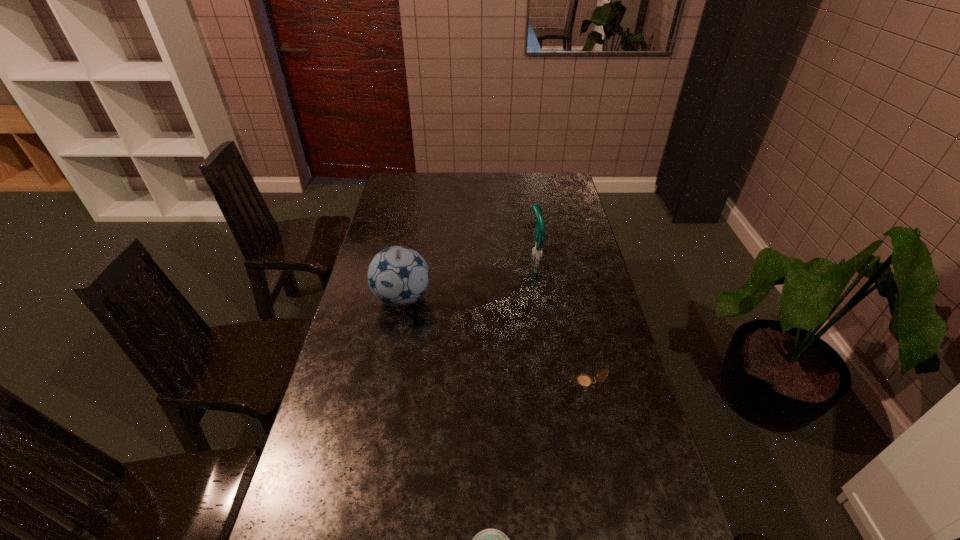
Locate an element on the screen. The width and height of the screenshot is (960, 540). vacant area between the third farthest object and the second object from right to left is located at coordinates (561, 318).

Find the location of a particular element. unoccupied position between the leftmost object and the compass is located at coordinates (494, 341).

Where is `blank region between the leftmost object and the farthest object`? This screenshot has width=960, height=540. blank region between the leftmost object and the farthest object is located at coordinates (468, 276).

At what (x,y) coordinates should I click in order to perform the action: click on vacant point located between the third object from left to right and the second farthest object. Please return your answer as a coordinate pair (x, y). Looking at the image, I should click on (468, 276).

Locate an element on the screen. object that can be found as the closest to the farthest object is located at coordinates [x=398, y=276].

Where is `object that can be found as the second closest to the second object from right to left`? The width and height of the screenshot is (960, 540). object that can be found as the second closest to the second object from right to left is located at coordinates (585, 381).

You are a GUI agent. You are given a task and a screenshot of the screen. Output one action in this format:
    pyautogui.click(x=<x>, y=<y>)
    Task: Click on the vacant region that satisfies the following two spatial constraints: 1. at the jaws of the bottle opener; 2. on the side with brand of the leftmost object
    This screenshot has height=540, width=960.
    Given the screenshot: What is the action you would take?
    pyautogui.click(x=541, y=299)

The width and height of the screenshot is (960, 540). What are the coordinates of `vacant space that satisfies the following two spatial constraints: 1. at the jaws of the third object from left to right; 2. on the side with brand of the third nearest object` in the screenshot? It's located at (541, 299).

Identify the location of free space that satisfies the following two spatial constraints: 1. at the jaws of the second object from right to left; 2. on the side with brand of the soccer ball. The height and width of the screenshot is (540, 960). pyautogui.click(x=541, y=299).